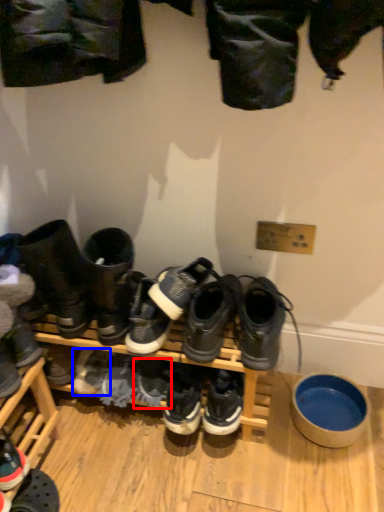
Question: Which of the following is the closest to the observer, shoe (highlighted by a red box) or footwear (highlighted by a blue box)?

Choices:
 (A) shoe
 (B) footwear

Answer: (A)